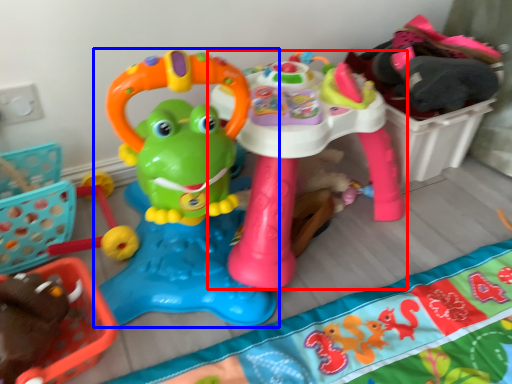
Question: Which of the following is the farthest to the observer, toy (highlighted by a red box) or toy (highlighted by a blue box)?

Choices:
 (A) toy
 (B) toy

Answer: (A)